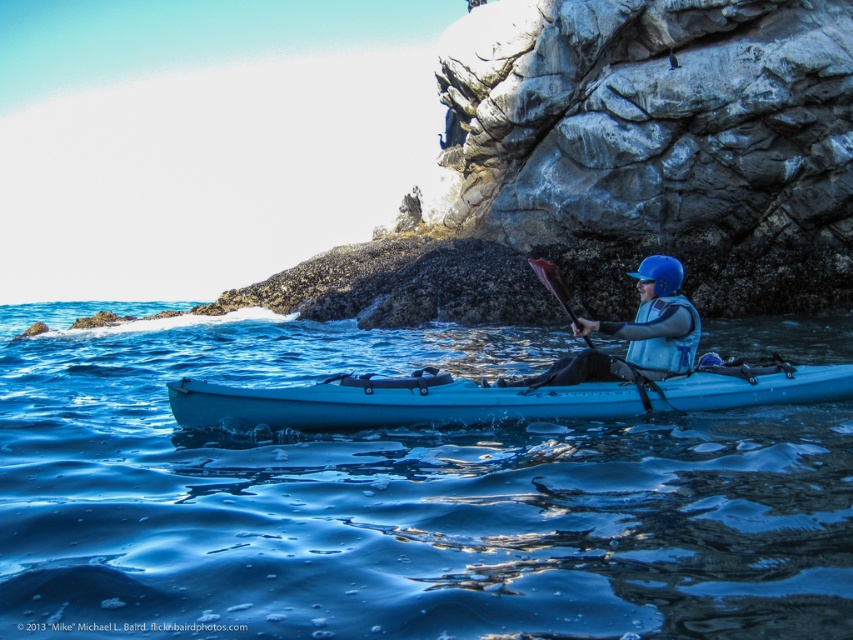
Question: Considering the relative positions of blue glossy water at center and light blue plastic canoe at center in the image provided, where is blue glossy water at center located with respect to light blue plastic canoe at center?

Choices:
 (A) above
 (B) below

Answer: (A)

Question: Is the position of light blue plastic canoe at center more distant than that of blue matte helmet at center?

Choices:
 (A) no
 (B) yes

Answer: (A)

Question: Among these points, which one is farthest from the camera?

Choices:
 (A) (639, 323)
 (B) (77, 314)

Answer: (B)

Question: Which object is closer to the camera taking this photo?

Choices:
 (A) blue glossy water at center
 (B) light blue plastic canoe at center

Answer: (A)

Question: Can you confirm if blue glossy water at center is positioned to the left of blue matte helmet at center?

Choices:
 (A) yes
 (B) no

Answer: (A)

Question: Which object is farther from the camera taking this photo?

Choices:
 (A) blue matte helmet at center
 (B) blue glossy water at center

Answer: (A)